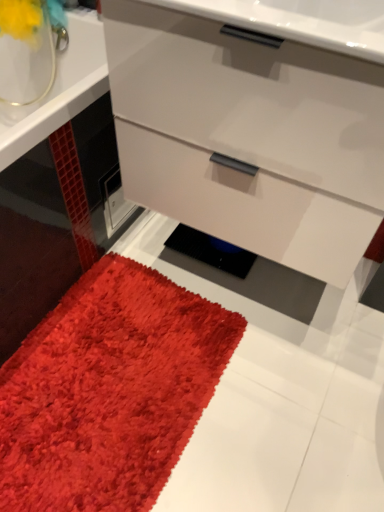
I want to click on free space above shaggy red carpet at lower left (from a real-world perspective), so click(x=100, y=381).